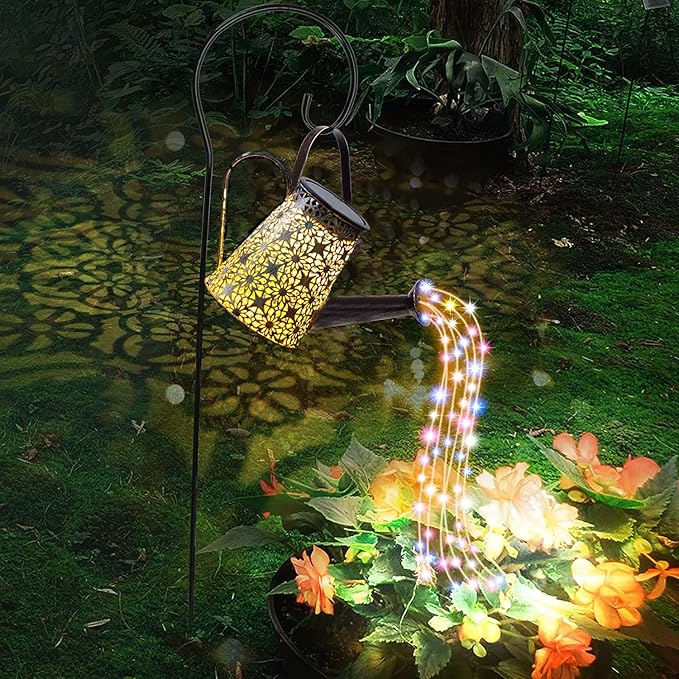
Find the location of a particular element. The height and width of the screenshot is (679, 679). pink light is located at coordinates (426, 441).